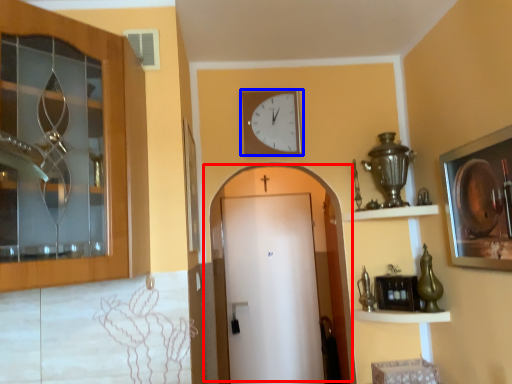
Question: Which of the following is the closest to the observer, door (highlighted by a red box) or wall clock (highlighted by a blue box)?

Choices:
 (A) door
 (B) wall clock

Answer: (B)